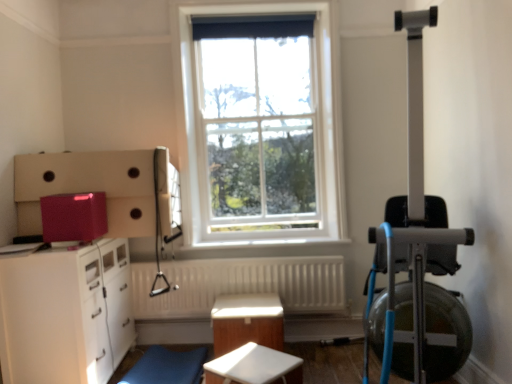
This screenshot has width=512, height=384. I want to click on vacant area on top of white glossy table at center, which ranks as the 2th table in front-to-back order (from a real-world perspective), so click(x=241, y=305).